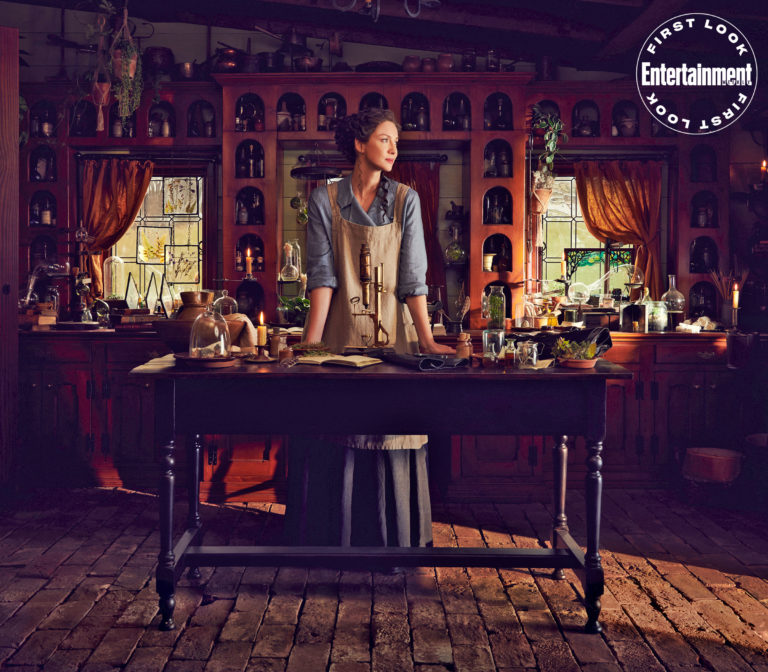
I want to click on wall behind cabinets, so click(47, 41).